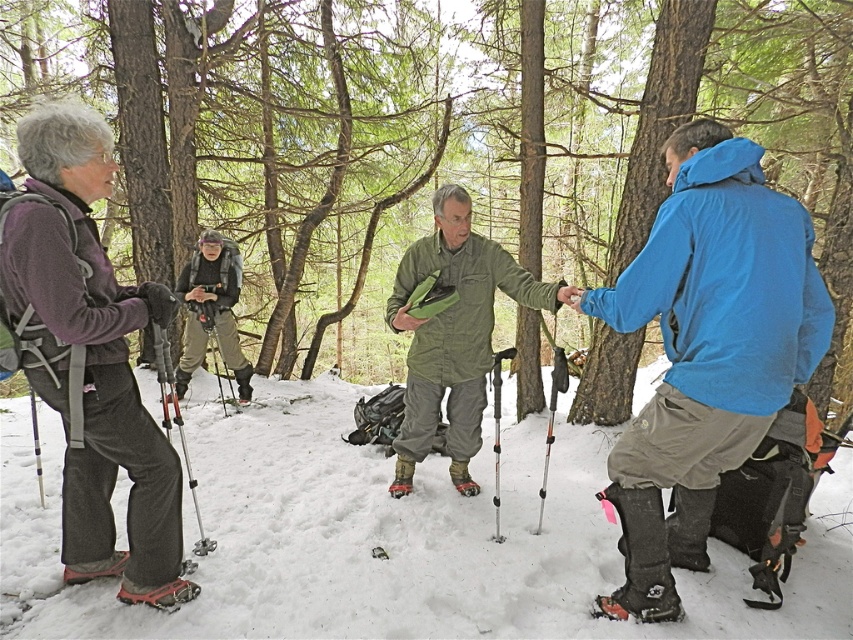
You are navigating through a snowy forest and need to determine which point is closer to you. The points are point [398,493] and point [512,348]. Which point is closer to you?

Point [398,493] is further to the viewer than point [512,348], so the closer point is point [512,348].

You are planning to take a photo of the rough bark tree at center and the white fluffy snow at center. Which object will appear larger in the photo?

The rough bark tree at center will appear larger in the photo because it is taller than the white fluffy snow at center.

You are a hiker planning to take a photo of the rough bark tree at center and the white fluffy snow at center. Which object should you focus on first if you want both to be in sharp focus?

The rough bark tree at center is above the white fluffy snow at center, so focusing on the rough bark tree at center first will ensure both are in sharp focus since it is closer to the camera.